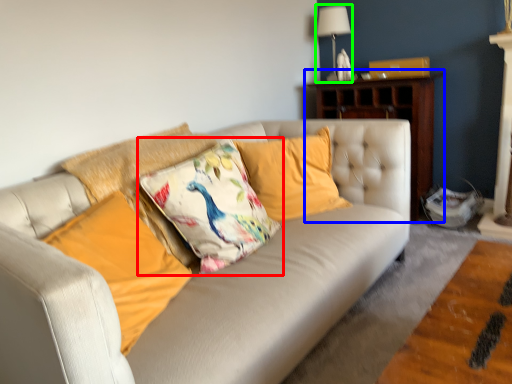
Question: Based on their relative distances, which object is farther from pillow (highlighted by a red box)? Choose from dresser (highlighted by a blue box) and lamp (highlighted by a green box).

Choices:
 (A) dresser
 (B) lamp

Answer: (B)